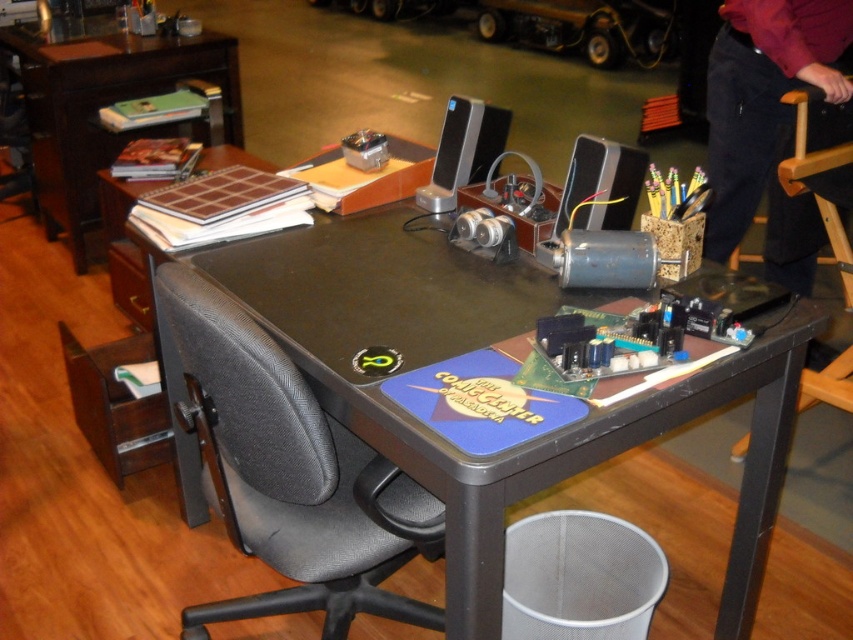
You are organizing a workspace and need to place a new tool kit. The black plastic table at center and the brown wood table at upper left are both options. Based on their positions, which table is located to the right side of the other?

The black plastic table at center is to the right of the brown wood table at upper left.